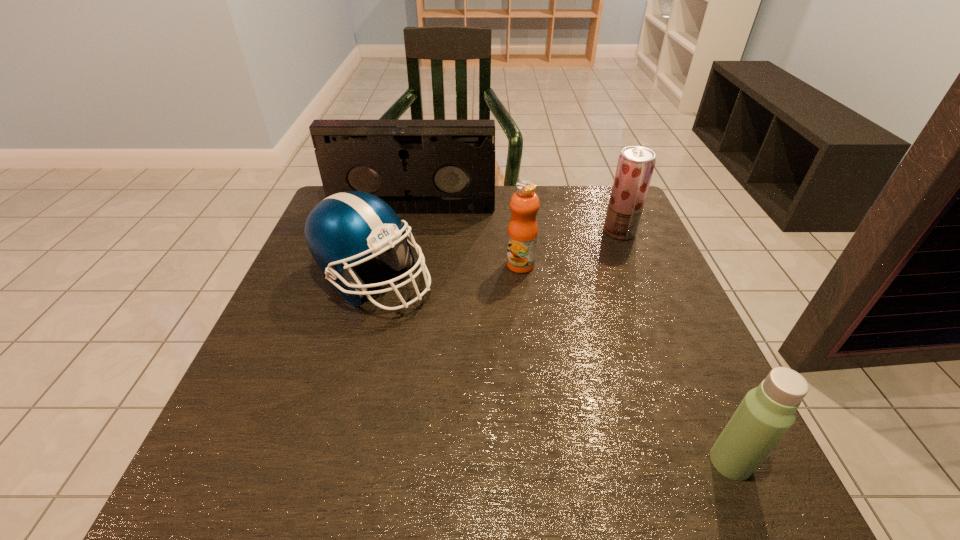
You are a GUI agent. You are given a task and a screenshot of the screen. Output one action in this format:
    pyautogui.click(x=<x>, y=<y>)
    Task: Click on the videotape
    This screenshot has height=540, width=960.
    Given the screenshot: What is the action you would take?
    pyautogui.click(x=416, y=166)

You are a GUI agent. You are given a task and a screenshot of the screen. Output one action in this format:
    pyautogui.click(x=<x>, y=<y>)
    Task: Click on the right fruit juice
    
    Given the screenshot: What is the action you would take?
    pyautogui.click(x=635, y=166)

What are the coordinates of `the fourth nearest object` in the screenshot? It's located at (635, 166).

You are a GUI agent. You are given a task and a screenshot of the screen. Output one action in this format:
    pyautogui.click(x=<x>, y=<y>)
    Task: Click on the third object from left to right
    This screenshot has width=960, height=540.
    Given the screenshot: What is the action you would take?
    pyautogui.click(x=522, y=235)

Where is `the nearer fruit juice`? The width and height of the screenshot is (960, 540). the nearer fruit juice is located at coordinates (522, 235).

I want to click on football helmet, so click(342, 230).

I want to click on the nearest object, so click(767, 412).

Identify the location of vacant area situated 0.250m on the front side of the farthest object. The height and width of the screenshot is (540, 960). (399, 274).

Locate an element on the screen. The height and width of the screenshot is (540, 960). free space located on the left of the farther fruit juice is located at coordinates (482, 232).

Identify the location of vacant space located on the front of the nearer fruit juice. (525, 308).